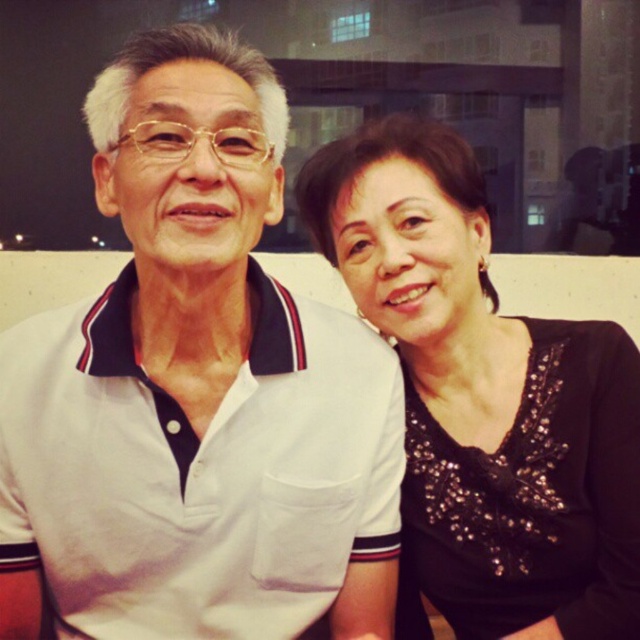
You are designing a gift box that needs to accommodate both the white cotton polo shirt at center and the black sequined blouse at right. Given their sizes, which item requires a larger compartment in the box?

The white cotton polo shirt at center requires a larger compartment in the box because it is larger in size than the black sequined blouse at right.

You are a photographer trying to capture a candid shot of the couple in the image. You notice two points marked in the scene. The first point is at coordinates point (16, 600), and the second is at point (356, 205). Which point is closer to the camera lens based on their positions?

Point (16, 600) is in front of point (356, 205), so it is closer to the camera lens.

You are a photographer adjusting the lighting for a portrait. The subject is wearing a white cotton polo shirt at center. To ensure proper exposure, you need to place a reflector directly below the shirt. Given the shirt is positioned at point 0.613 on the horizontal axis and 0.308 on the vertical axis, where should you place the reflector relative to the shirt?

The reflector should be placed directly below the white cotton polo shirt at center, which is located at coordinates 0.613 horizontally and 0.308 vertically. Since the reflector needs to be below, it should be positioned at the same horizontal coordinate 0.613 but lower on the vertical axis than 0.308.